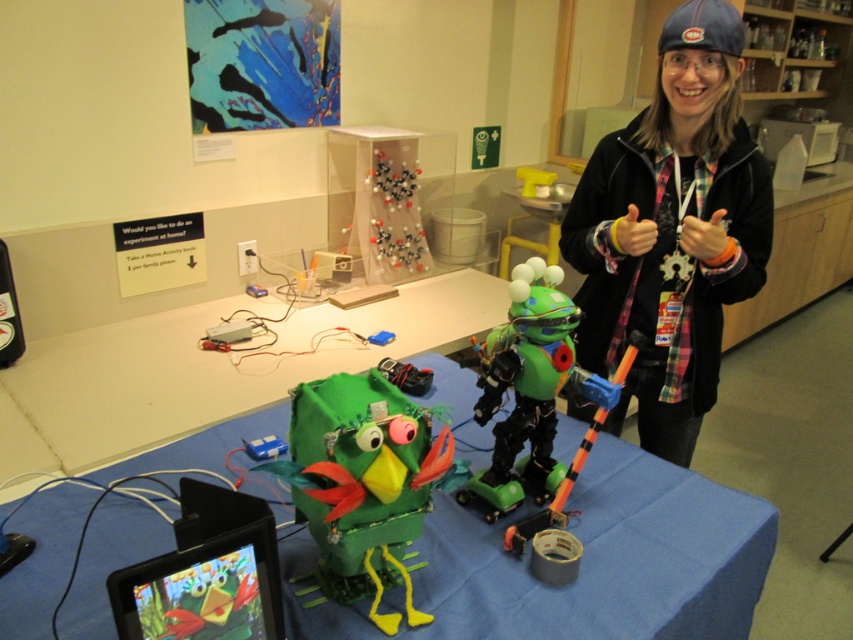
This screenshot has width=853, height=640. What are the coordinates of `green cardboard table at center` in the screenshot? It's located at (581, 564).

Between green cardboard table at center and green matte robot at center, which one is positioned higher?

green matte robot at center

Identify the location of green cardboard table at center. The image size is (853, 640). (581, 564).

Does plaid flannel shirt at center appear on the left side of green cardboard bird at center?

Incorrect, plaid flannel shirt at center is not on the left side of green cardboard bird at center.

Who is positioned more to the right, plaid flannel shirt at center or green cardboard bird at center?

Positioned to the right is plaid flannel shirt at center.

In order to click on plaid flannel shirt at center in this screenshot , I will do click(x=672, y=230).

Is plaid flannel shirt at center bigger than green matte robot at center?

Yes, plaid flannel shirt at center is bigger than green matte robot at center.

Who is lower down, plaid flannel shirt at center or green matte robot at center?

green matte robot at center

What do you see at coordinates (672, 230) in the screenshot? I see `plaid flannel shirt at center` at bounding box center [672, 230].

The width and height of the screenshot is (853, 640). What are the coordinates of `plaid flannel shirt at center` in the screenshot? It's located at (672, 230).